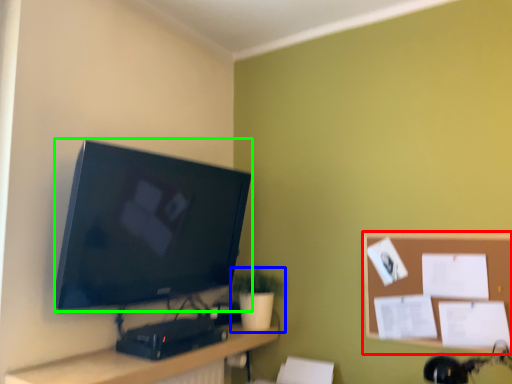
Question: Based on their relative distances, which object is nearer to bulletin board (highlighted by a red box)? Choose from houseplant (highlighted by a blue box) and television (highlighted by a green box).

Choices:
 (A) houseplant
 (B) television

Answer: (A)